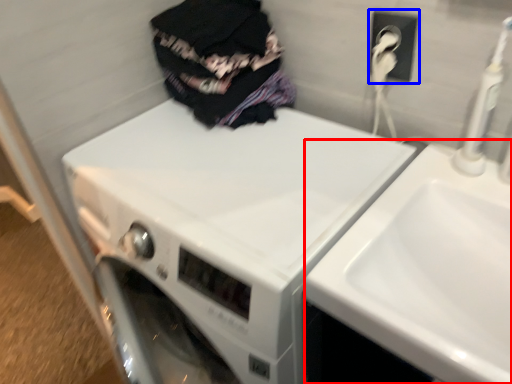
Question: Which point is further to the camera, sink (highlighted by a red box) or electric outlet (highlighted by a blue box)?

Choices:
 (A) sink
 (B) electric outlet

Answer: (B)